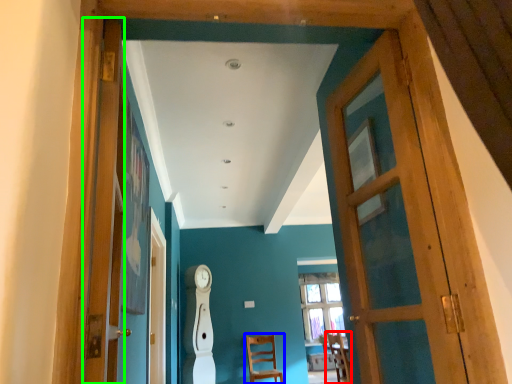
Question: Which object is the closest to the chair (highlighted by a red box)? Choose among these: chair (highlighted by a blue box) or door (highlighted by a green box).

Choices:
 (A) chair
 (B) door

Answer: (A)